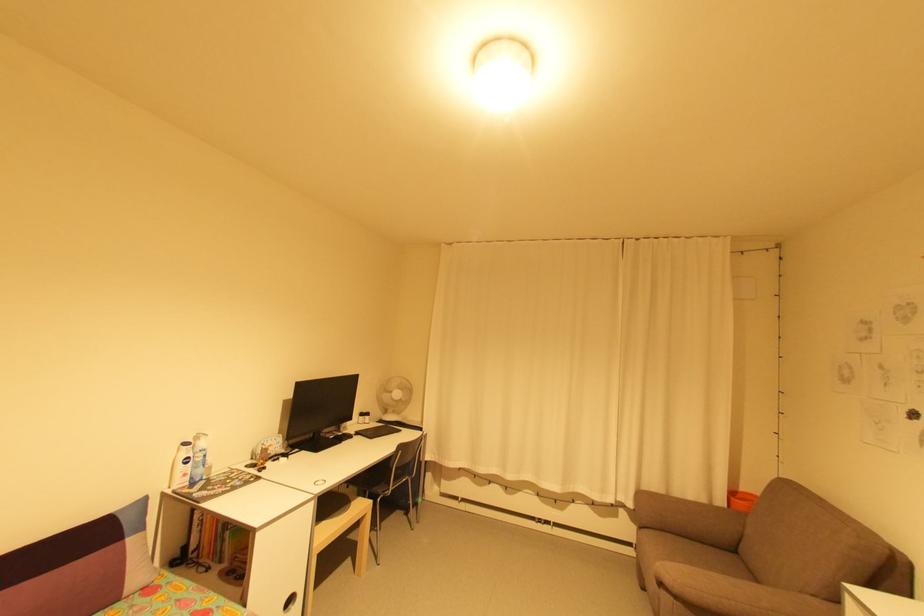
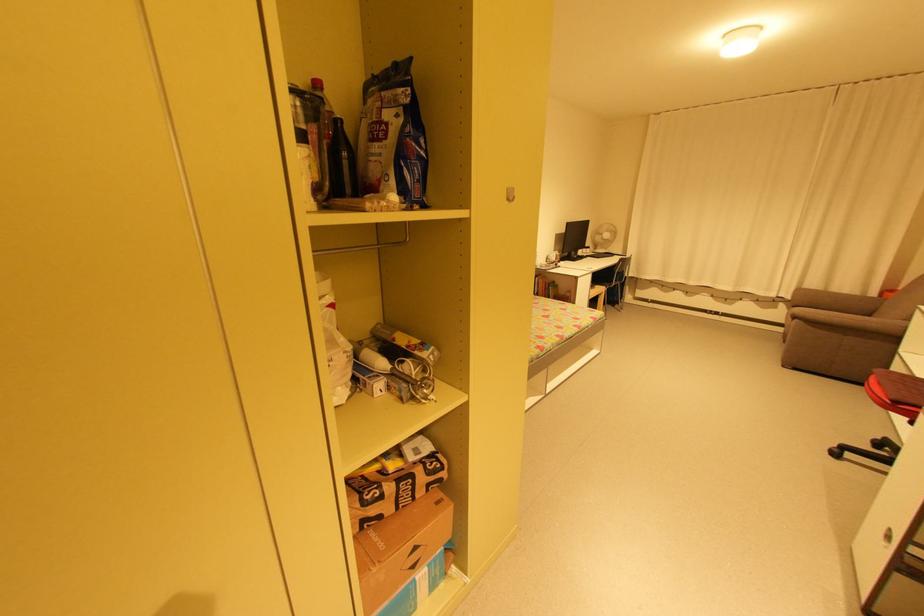
Find the pixel in the second image that matches (x=371, y=418) in the first image.

(592, 249)